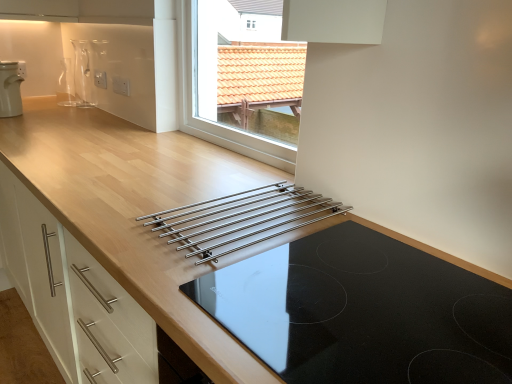
Question: From a real-world perspective, relative to stainless steel rack at center, is white plastic kettle at upper left vertically above or below?

Choices:
 (A) above
 (B) below

Answer: (A)

Question: Is white plastic kettle at upper left to the left or to the right of stainless steel rack at center in the image?

Choices:
 (A) right
 (B) left

Answer: (B)

Question: Which object is positioned farthest from the transparent glass vase at upper left?

Choices:
 (A) black glass cooktop at center
 (B) white plastic kettle at upper left
 (C) stainless steel rack at center

Answer: (A)

Question: Which object is positioned closest to the transparent glass vase at upper left?

Choices:
 (A) black glass cooktop at center
 (B) white plastic kettle at upper left
 (C) stainless steel rack at center

Answer: (B)